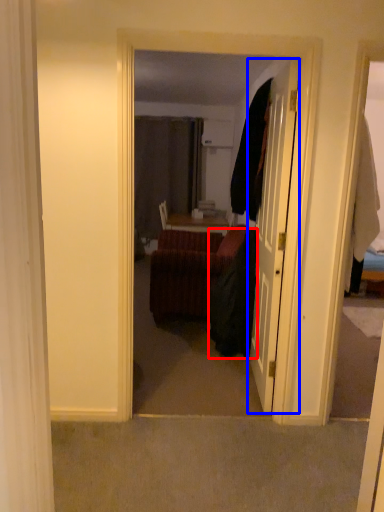
Question: Which of the following is the closest to the observer, robe (highlighted by a red box) or door (highlighted by a blue box)?

Choices:
 (A) robe
 (B) door

Answer: (B)